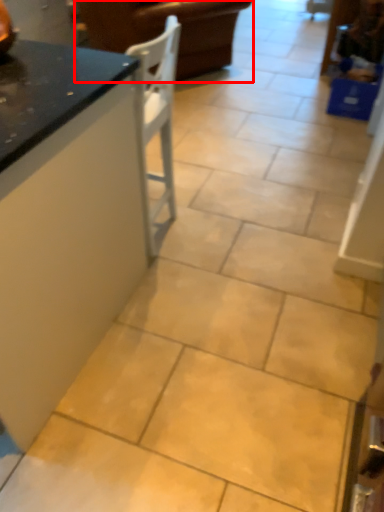
Question: From the image's perspective, where is furniture (annotated by the red box) located in relation to countertop in the image?

Choices:
 (A) above
 (B) below

Answer: (A)